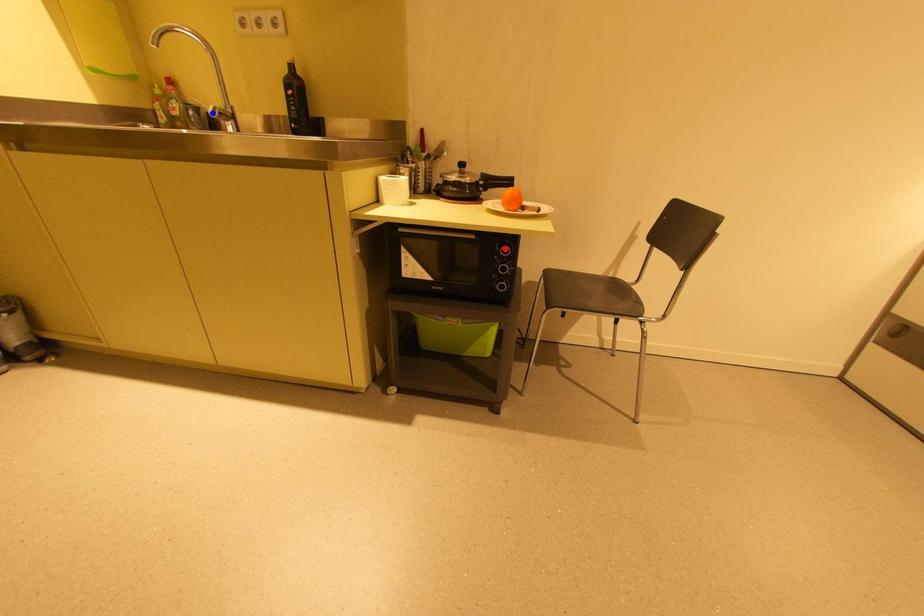
Question: In the image, two points are highlighted. Which point is nearer to the camera? Reply with the corresponding letter.

Choices:
 (A) blue point
 (B) red point

Answer: (B)